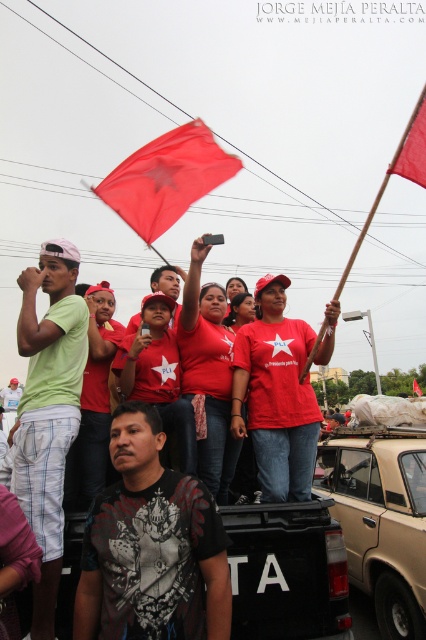
You are a photographer trying to capture a clear photo of the dark gray printed shirt at center. The scene is crowded with people on a truck and the lighting is overcast. Where should you position your camera to ensure the shirt is in the center of your photo?

Position your camera so that the dark gray printed shirt at center is at the coordinates 0.855 on the x axis and 0.354 on the y axis. This will ensure the shirt is centered in your photo based on its 2D location.

You are a photographer standing at the scene. You want to take a closeup photo of the dark gray printed shirt at center. Considering your current position, is it within a comfortable shooting distance for a typical DSLR camera?

The dark gray printed shirt at center is 10.10 feet away from viewer, which is a comfortable distance for a typical DSLR camera to capture a clear closeup photo.

What is the color of the shirt located at the coordinates point (150,547) in the image?

The point (150,547) corresponds to the dark gray printed shirt at center.